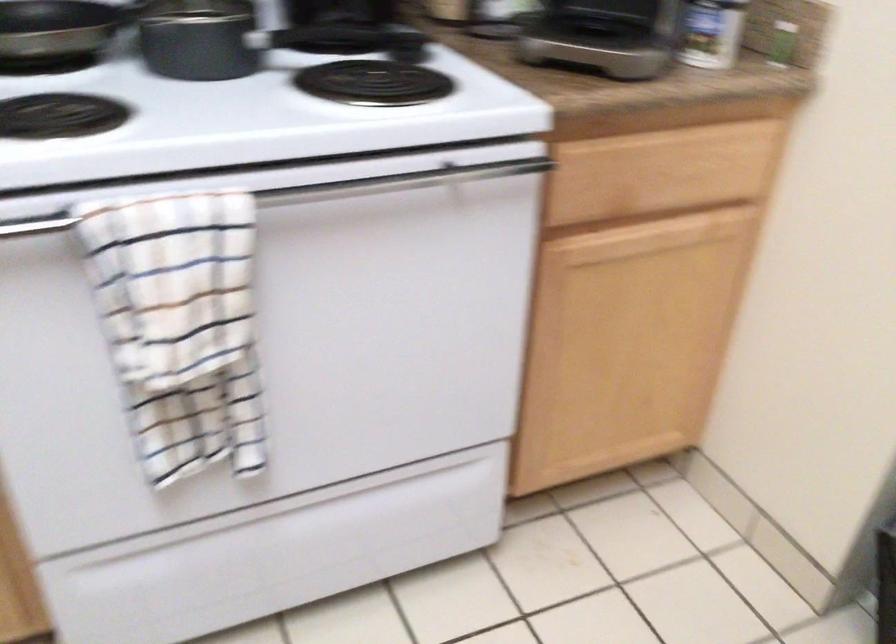
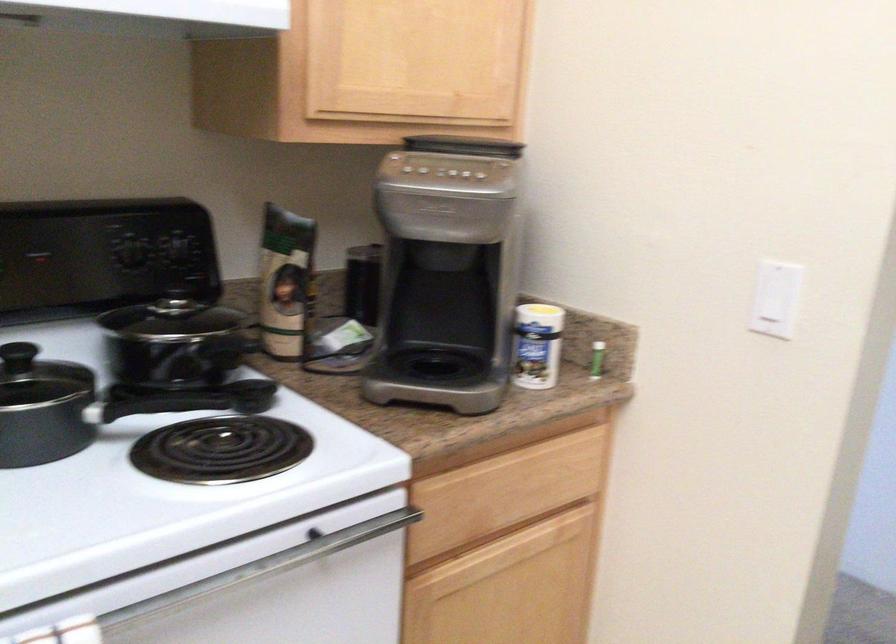
Locate, in the second image, the point that corresponds to the point at 644,238 in the first image.

(504, 554)